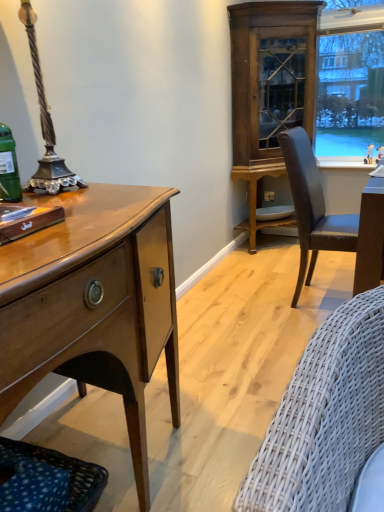
Question: Does point (322, 241) appear closer or farther from the camera than point (271, 217)?

Choices:
 (A) closer
 (B) farther

Answer: (A)

Question: Considering the relative positions of leather-like chair at right and white glossy plate at lower center in the image provided, is leather-like chair at right to the left or to the right of white glossy plate at lower center?

Choices:
 (A) left
 (B) right

Answer: (B)

Question: Estimate the real-world distances between objects in this image. Which object is closer to the wooden cabinet at upper right?

Choices:
 (A) white glossy plate at lower center
 (B) shiny brown desk at left
 (C) matte plastic power outlet at lower center
 (D) dark blue woven fabric couch at lower left
 (E) leather-like chair at right

Answer: (A)

Question: Which object is positioned closest to the dark blue woven fabric couch at lower left?

Choices:
 (A) white glossy plate at lower center
 (B) matte plastic power outlet at lower center
 (C) leather-like chair at right
 (D) shiny brown desk at left
 (E) wooden cabinet at upper right

Answer: (D)